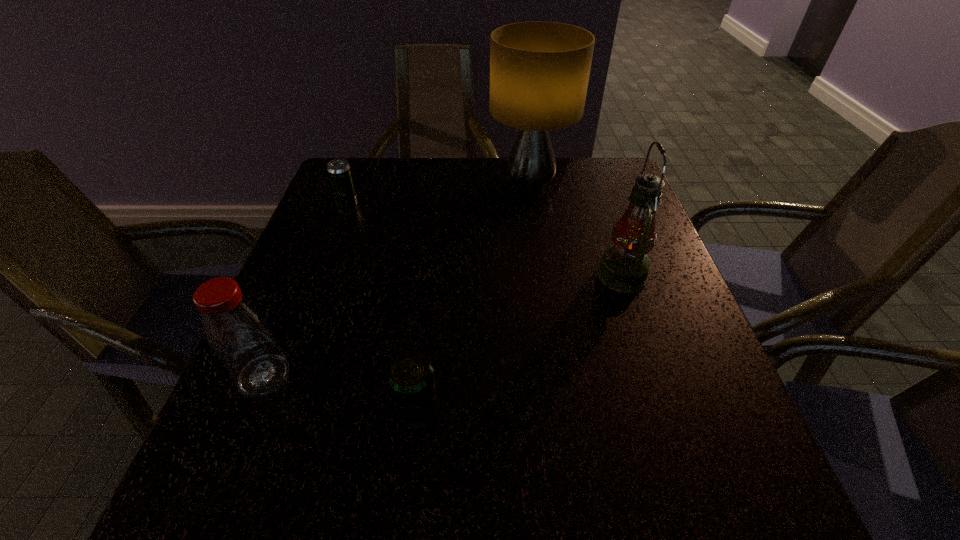
In the image, there is a desktop. At what (x,y) coordinates should I click in order to perform the action: click on vacant space at the near edge. Please return your answer as a coordinate pair (x, y). This screenshot has width=960, height=540. Looking at the image, I should click on (421, 479).

In the image, there is a desktop. Where is `vacant region at the left edge`? The height and width of the screenshot is (540, 960). vacant region at the left edge is located at coordinates click(316, 218).

In the image, there is a desktop. In order to click on vacant area at the right edge in this screenshot , I will do `click(590, 240)`.

The image size is (960, 540). In order to click on vacant space at the near left corner in this screenshot , I will do `click(210, 509)`.

The width and height of the screenshot is (960, 540). Find the location of `vacant space at the far right corner`. vacant space at the far right corner is located at coordinates (620, 186).

Find the location of a particular element. The height and width of the screenshot is (540, 960). free space at the near right corner of the desktop is located at coordinates (663, 488).

Locate an element on the screen. The image size is (960, 540). vacant area that lies between the third tallest object and the nearer beer can is located at coordinates (340, 391).

Where is `vacant space in between the shorter beer can and the bottle`? The image size is (960, 540). vacant space in between the shorter beer can and the bottle is located at coordinates (340, 391).

The width and height of the screenshot is (960, 540). Identify the location of free area in between the right beer can and the second object from right to left. (472, 295).

Find the location of a particular element. This screenshot has height=540, width=960. vacant area that lies between the third tallest object and the fourth object from left to right is located at coordinates (396, 281).